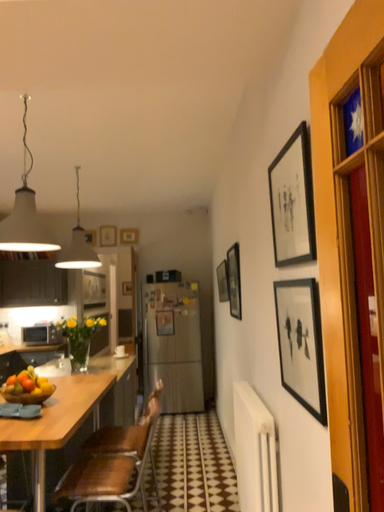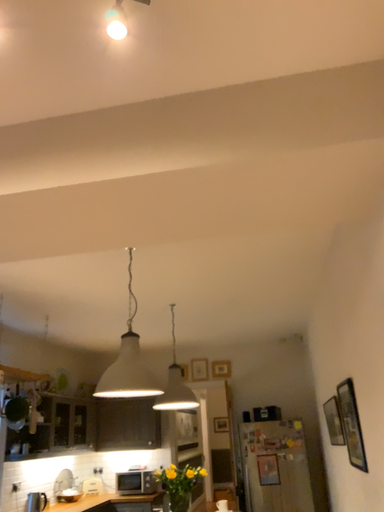
Question: How did the camera likely rotate when shooting the video?

Choices:
 (A) rotated downward
 (B) rotated upward

Answer: (B)